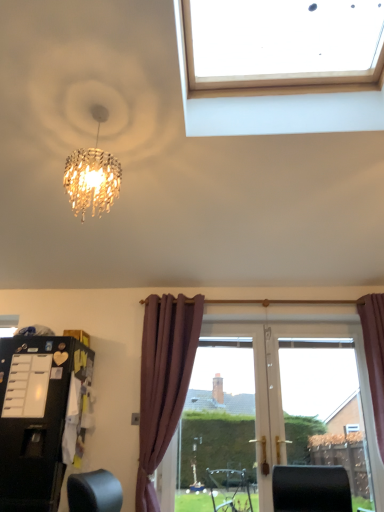
Question: Based on their positions, is purple velvet curtain at right located to the left or right of black matte refrigerator at lower left?

Choices:
 (A) right
 (B) left

Answer: (A)

Question: Considering the positions of point (382, 371) and point (46, 398), is point (382, 371) closer or farther from the camera than point (46, 398)?

Choices:
 (A) closer
 (B) farther

Answer: (B)

Question: Relative to black matte refrigerator at lower left, is purple velvet curtain at right in front or behind?

Choices:
 (A) behind
 (B) front

Answer: (A)

Question: In the image, is black matte refrigerator at lower left on the left side or the right side of purple velvet curtain at right?

Choices:
 (A) right
 (B) left

Answer: (B)

Question: From a real-world perspective, is black matte refrigerator at lower left positioned above or below purple velvet curtain at right?

Choices:
 (A) below
 (B) above

Answer: (A)

Question: Is point (51, 404) closer or farther from the camera than point (379, 422)?

Choices:
 (A) closer
 (B) farther

Answer: (A)

Question: Looking at their shapes, would you say black matte refrigerator at lower left is wider or thinner than purple velvet curtain at right?

Choices:
 (A) wide
 (B) thin

Answer: (A)